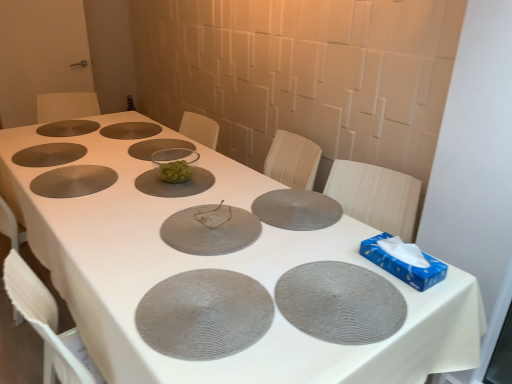
At what (x,y) coordinates should I click in order to perform the action: click on vacant space that's between clear glass bowl at center, marked as the 6th glass plate in a front-to-back arrangement, and transparent glass bowl at center, arranged as the 8th glass plate when viewed from the front. Please return your answer as a coordinate pair (x, y). The image size is (512, 384). Looking at the image, I should click on (150, 159).